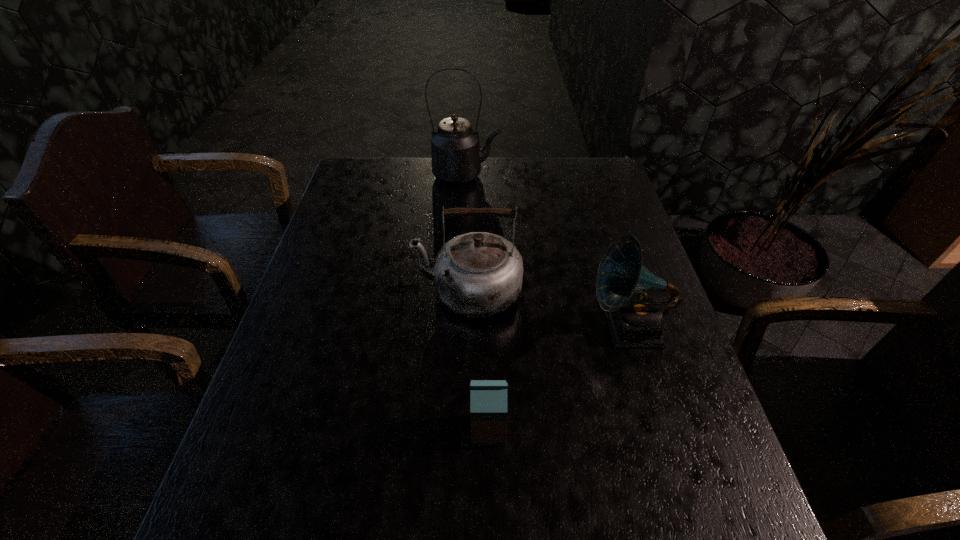
The height and width of the screenshot is (540, 960). I want to click on vacant position in the image that satisfies the following two spatial constraints: 1. spout on the shortest object; 2. on the right side of the farthest object, so click(x=456, y=430).

The height and width of the screenshot is (540, 960). Find the location of `vacant space that satisfies the following two spatial constraints: 1. spout on the farthest object; 2. on the back side of the milk carton`. vacant space that satisfies the following two spatial constraints: 1. spout on the farthest object; 2. on the back side of the milk carton is located at coordinates (456, 430).

Image resolution: width=960 pixels, height=540 pixels. Find the location of `free point that satisfies the following two spatial constraints: 1. spout on the tallest object; 2. at the spout of the nearer kettle`. free point that satisfies the following two spatial constraints: 1. spout on the tallest object; 2. at the spout of the nearer kettle is located at coordinates (462, 291).

The width and height of the screenshot is (960, 540). I want to click on free point that satisfies the following two spatial constraints: 1. spout on the farthest object; 2. at the spout of the nearer kettle, so click(x=462, y=291).